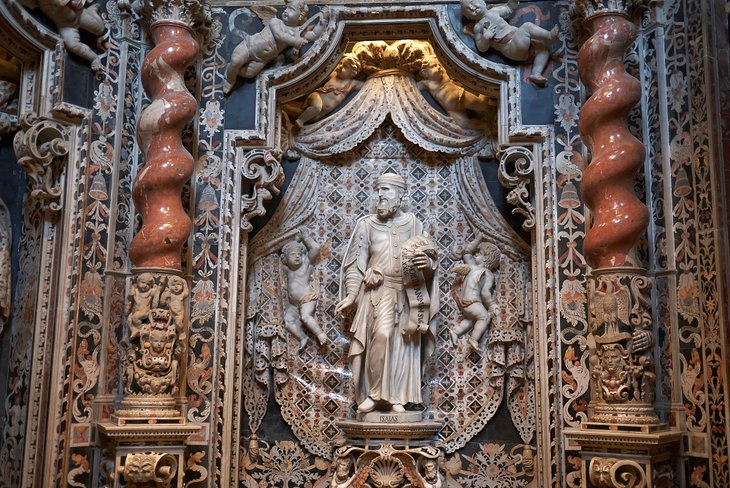
Where is `wallpaper`? The height and width of the screenshot is (488, 730). wallpaper is located at coordinates (457, 411), (196, 375), (12, 373), (399, 57), (566, 251), (696, 328).